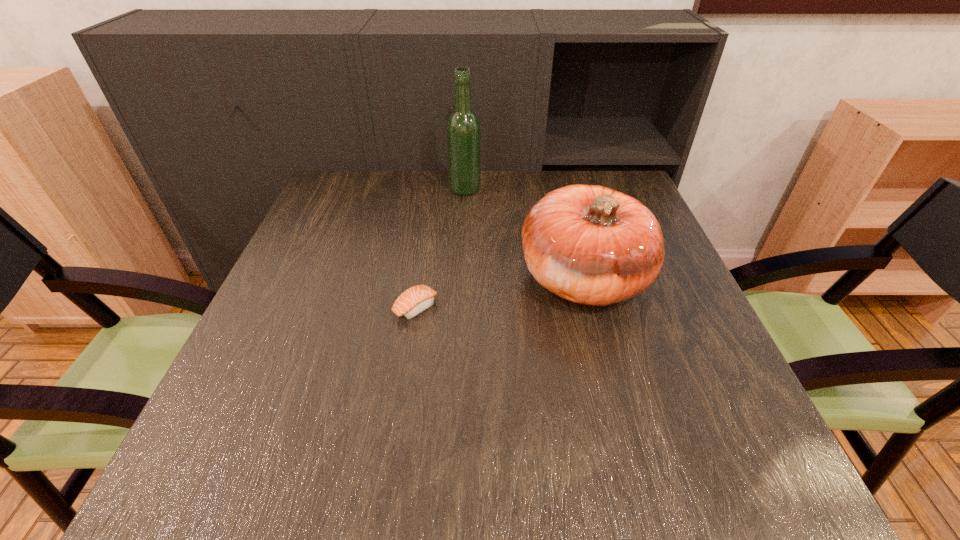
This screenshot has height=540, width=960. In order to click on free space that is in between the tallest object and the sushi in this screenshot , I will do point(441,248).

Where is `free space between the rightmost object and the sushi`? This screenshot has width=960, height=540. free space between the rightmost object and the sushi is located at coordinates click(499, 293).

The height and width of the screenshot is (540, 960). What are the coordinates of `free spot between the sushi and the liquor` in the screenshot? It's located at (441, 248).

Select which object is the closest to the leftmost object. Please provide its 2D coordinates. Your answer should be formatted as a tuple, i.e. [(x, y)], where the tuple contains the x and y coordinates of a point satisfying the conditions above.

[(589, 244)]

Identify which object is located as the second nearest to the rightmost object. Please provide its 2D coordinates. Your answer should be formatted as a tuple, i.e. [(x, y)], where the tuple contains the x and y coordinates of a point satisfying the conditions above.

[(463, 127)]

Identify the location of free space that satisfies the following two spatial constraints: 1. on the front side of the rightmost object; 2. on the right side of the farthest object. (461, 278).